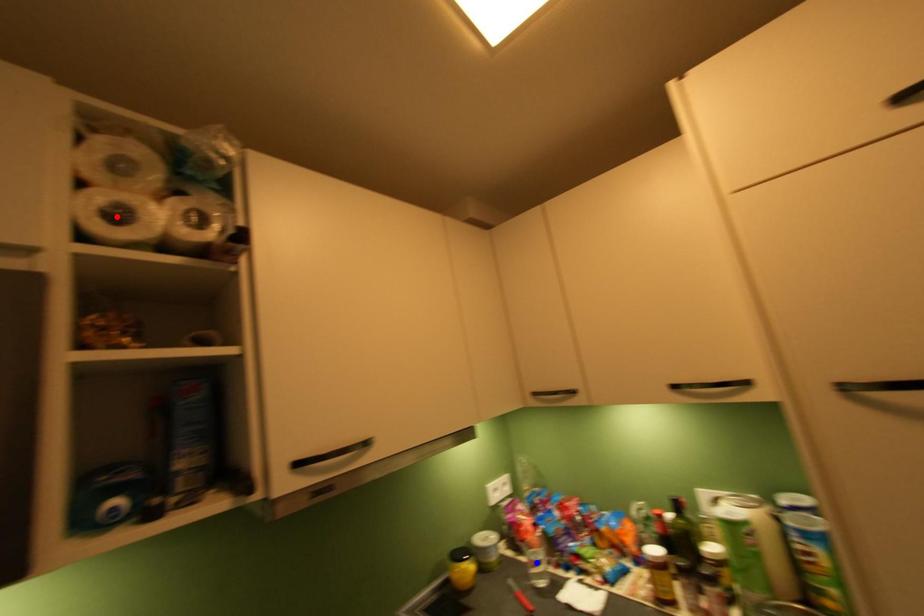
Question: Two points are marked on the image. Which point is closer to the camera?

Choices:
 (A) Blue point is closer.
 (B) Red point is closer.

Answer: (B)